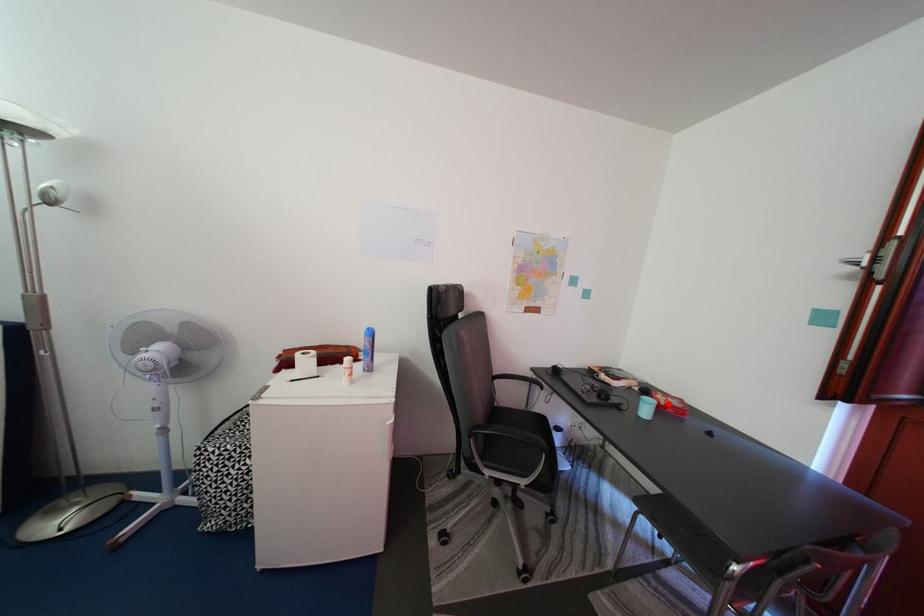
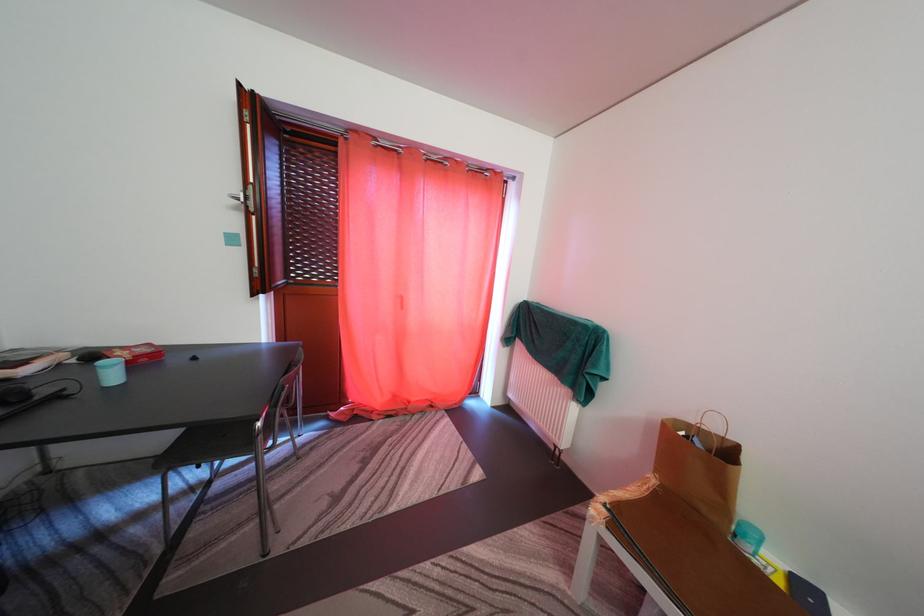
Find the pixel in the second image that matches the highlighted location in the first image.

(128, 360)